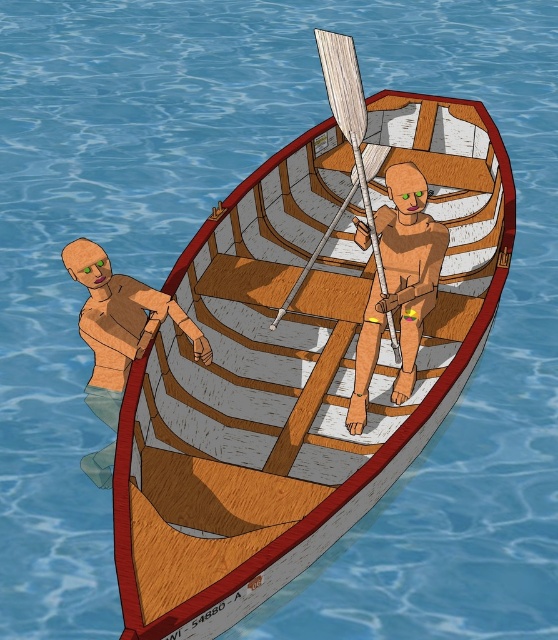
You are a passenger in the wooden boat at center and you want to reach the wooden paddle at center. Can you easily reach it without moving your position?

The wooden boat at center is below the wooden paddle at center, so you can easily reach the wooden paddle at center without moving your position because it is located above you.

You are standing on the dock and want to row the wooden rowboat. You see the wooden oar at center and the wooden paddle at center. Which one is closer to you?

The wooden oar at center is closer to you because the wooden paddle at center is behind it.

You are standing on the shore and see the wooden rowboat with the wooden man at left and the wooden paddle at center. Which object is closer to you?

The wooden man at left is closer to you because he is further to the viewer than the wooden paddle at center.